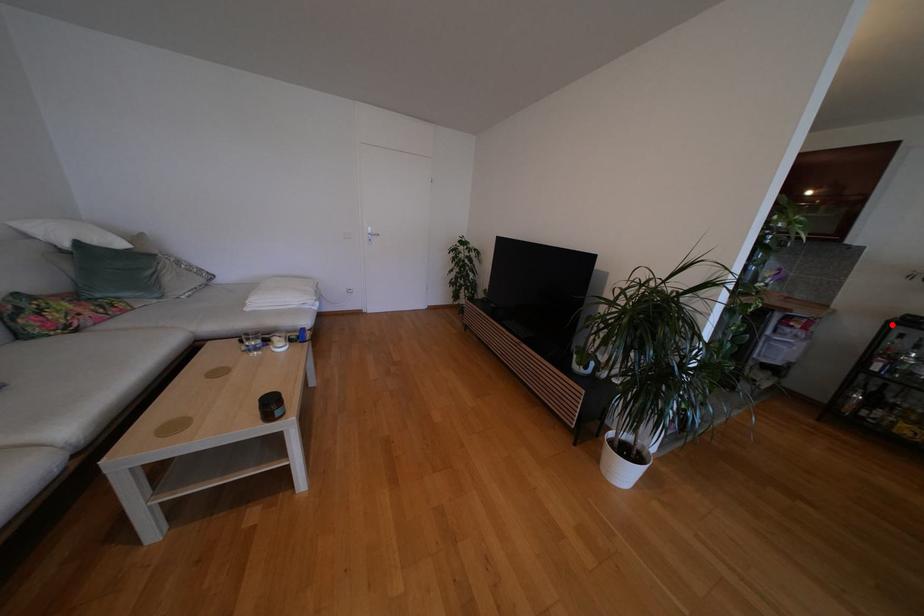
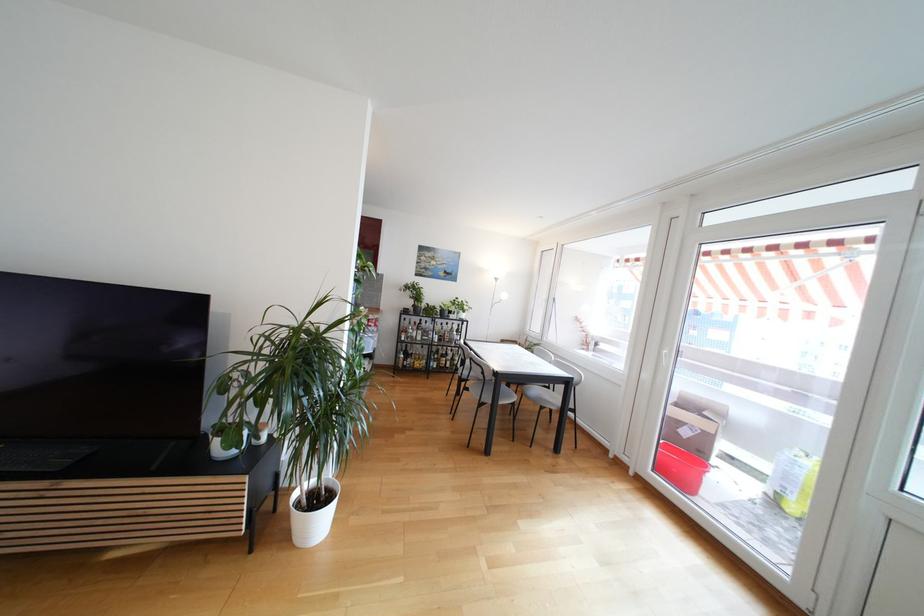
Locate, in the second image, the point that corresponds to the highlighted location in the first image.

(405, 315)